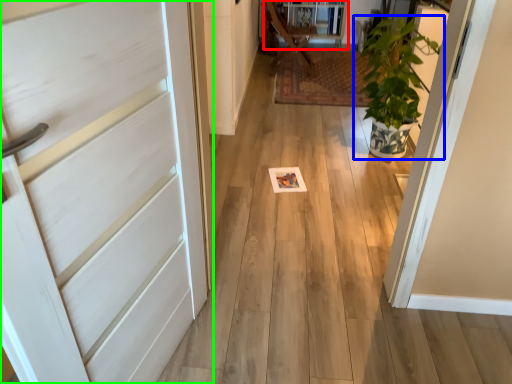
Question: Considering the real-world distances, which object is farthest from bookshelf (highlighted by a red box)? houseplant (highlighted by a blue box) or door (highlighted by a green box)?

Choices:
 (A) houseplant
 (B) door

Answer: (B)